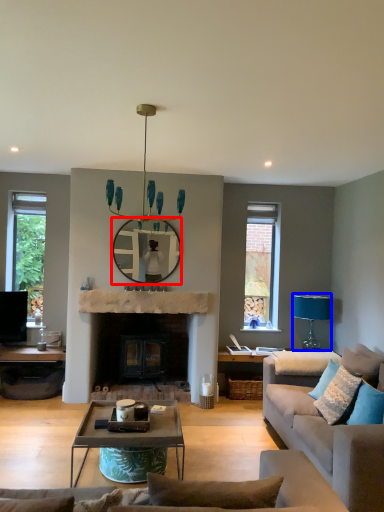
Question: Which object appears closest to the camera in this image, mirror (highlighted by a red box) or lamp (highlighted by a blue box)?

Choices:
 (A) mirror
 (B) lamp

Answer: (A)